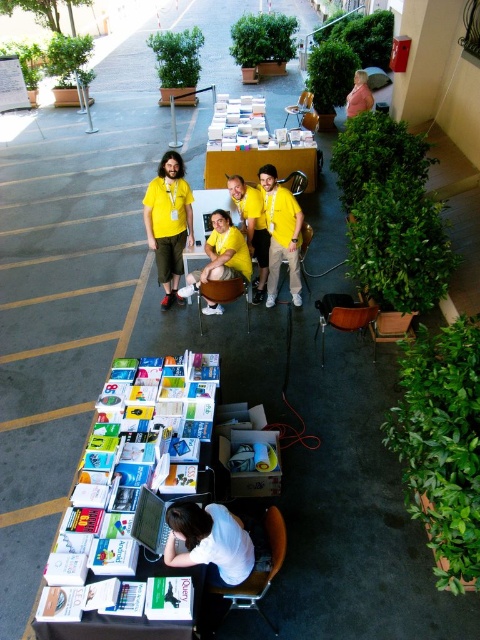
Question: Is yellow t-shirt at center closer to camera compared to yellow matte shirt at center?

Choices:
 (A) yes
 (B) no

Answer: (A)

Question: Which point appears closest to the camera in this image?

Choices:
 (A) (132, 406)
 (B) (184, 198)
 (C) (204, 561)
 (D) (216, 314)

Answer: (C)

Question: Does yellow matte shirt at center appear over pink fabric jacket at upper right?

Choices:
 (A) yes
 (B) no

Answer: (B)

Question: Which point is closer to the camera?

Choices:
 (A) white paper table at lower left
 (B) yellow matte shirt at center

Answer: (A)

Question: Which point is farther to the camera?

Choices:
 (A) yellow matte shirt at center
 (B) yellow fabric shirt at center

Answer: (A)

Question: Does white matte shirt at lower center appear over yellow matte shirt at center?

Choices:
 (A) no
 (B) yes

Answer: (A)